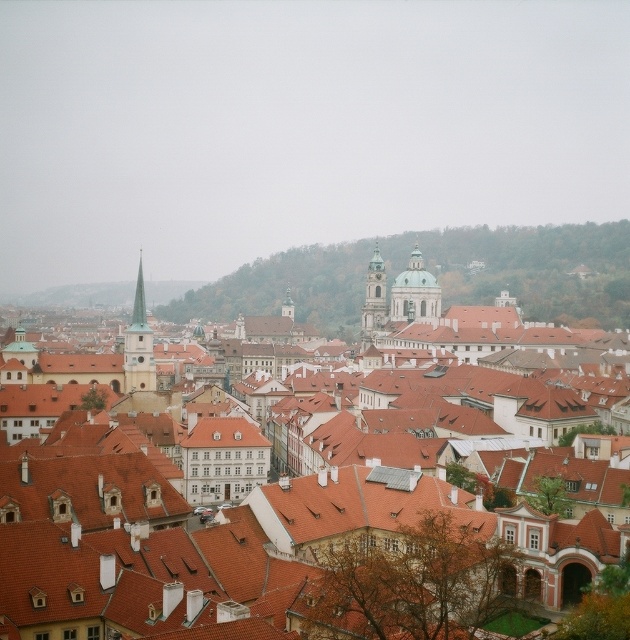
You are an architect analyzing the skyline of this historic city. You observe the gold domed tower at center and the green glass spire at center. Which structure appears taller in the image?

The green glass spire at center appears taller than the gold domed tower at center because the gold domed tower at center is smaller than the green glass spire at center according to the description.

You are a tourist standing at the entrance of the city square. You see the gold domed tower at center in the distance. If you were to walk directly towards it, which direction should you head based on its current position?

The gold domed tower at center is located at coordinates point (415, 292), so you should head northeast to reach it.